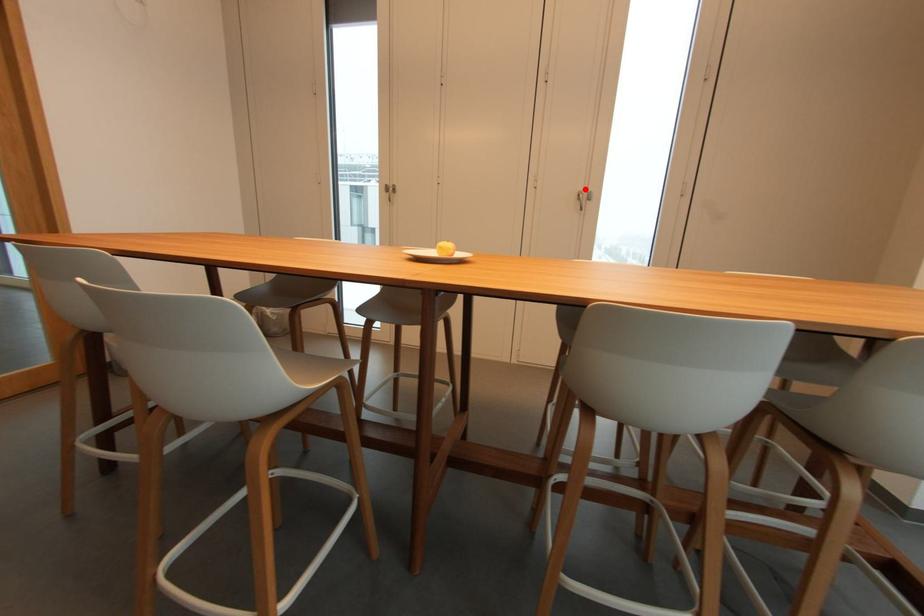
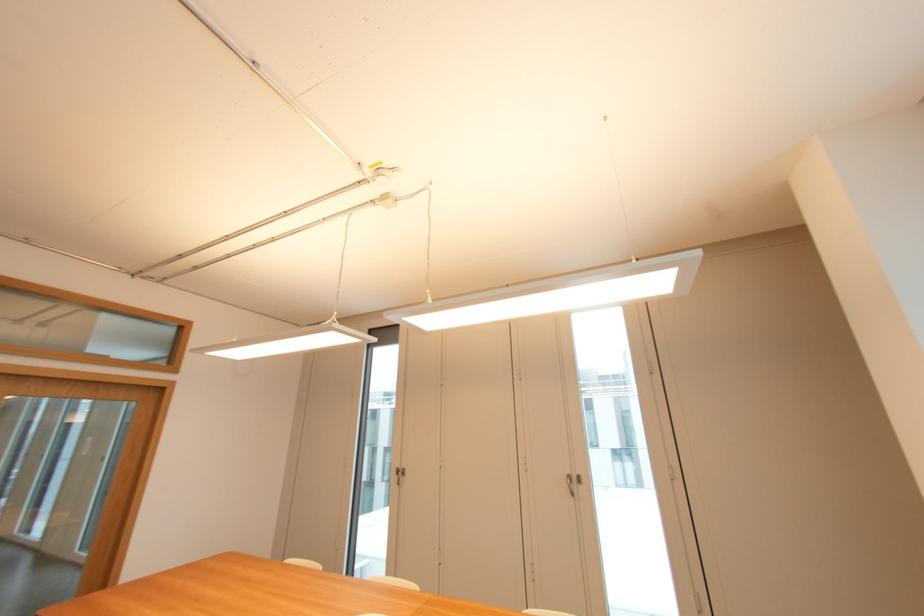
Find the pixel in the second image that matches the highlighted location in the first image.

(574, 472)